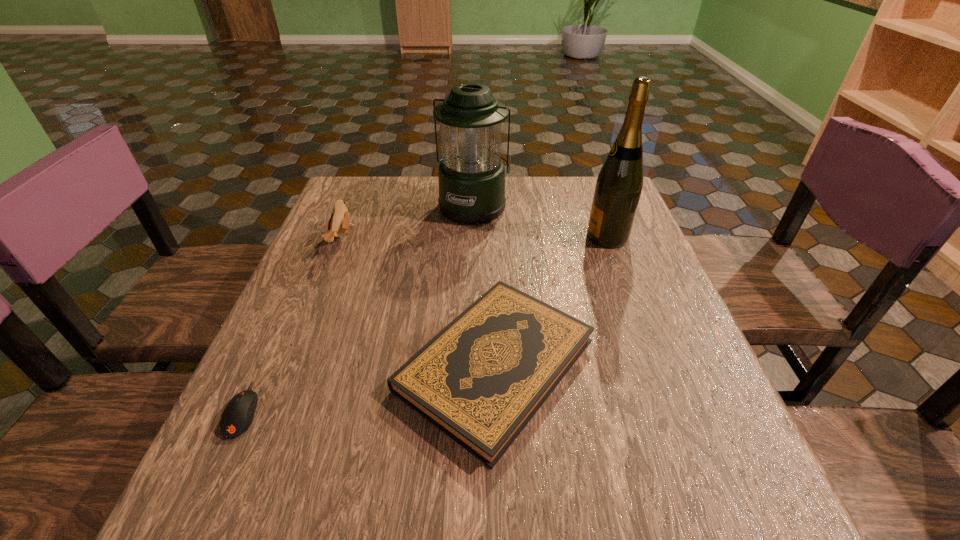
This screenshot has height=540, width=960. I want to click on free space that is in between the computer mouse and the second tallest object, so click(x=359, y=307).

Where is `unoccupied position between the lantern and the fourth tallest object`? Image resolution: width=960 pixels, height=540 pixels. unoccupied position between the lantern and the fourth tallest object is located at coordinates (485, 285).

This screenshot has width=960, height=540. In order to click on free space between the wine bottle and the bird in this screenshot , I will do `click(474, 239)`.

You are a GUI agent. You are given a task and a screenshot of the screen. Output one action in this format:
    pyautogui.click(x=<x>, y=<y>)
    Task: Click on the free space that is in between the rightmost object and the fourth tallest object
    
    Given the screenshot: What is the action you would take?
    [551, 301]

Select which object appears as the second closest to the lantern. Please provide its 2D coordinates. Your answer should be formatted as a tuple, i.e. [(x, y)], where the tuple contains the x and y coordinates of a point satisfying the conditions above.

[(339, 222)]

Find the location of `object that stands as the second closest to the second object from left to right`. object that stands as the second closest to the second object from left to right is located at coordinates (471, 174).

Where is `vacant space that satisfies the following two spatial constraints: 1. at the beak of the fourth object from right to left; 2. on the front side of the shortest object`? This screenshot has height=540, width=960. vacant space that satisfies the following two spatial constraints: 1. at the beak of the fourth object from right to left; 2. on the front side of the shortest object is located at coordinates (275, 409).